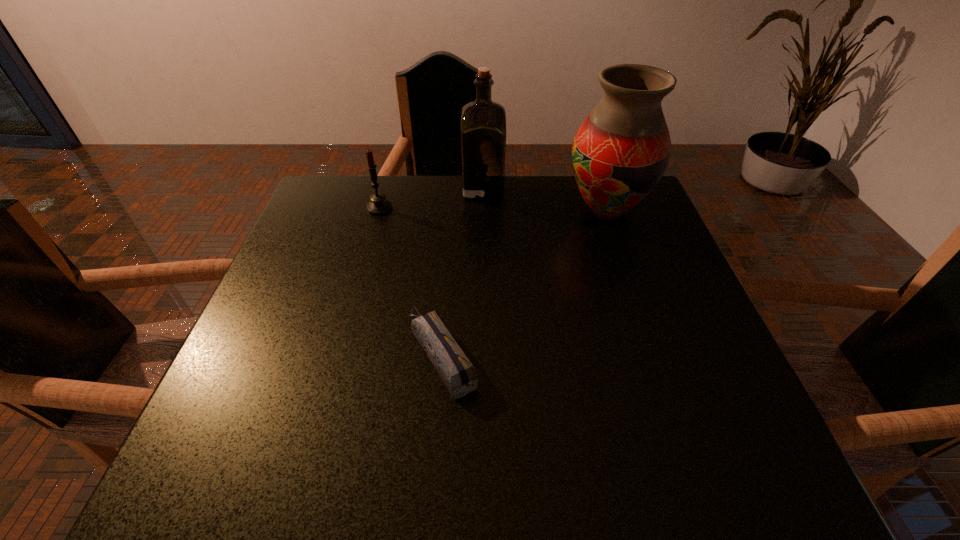
At what (x,y) coordinates should I click in order to perform the action: click on free location that satisfies the following two spatial constraints: 1. on the label of the liquor; 2. on the left side of the vase. Please return your answer as a coordinate pair (x, y). This screenshot has width=960, height=540. Looking at the image, I should click on (483, 211).